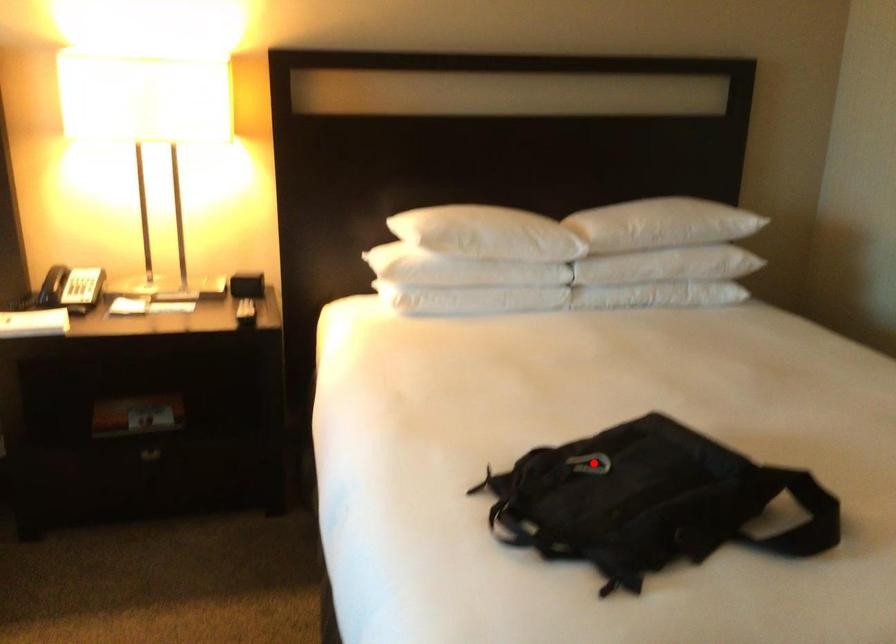
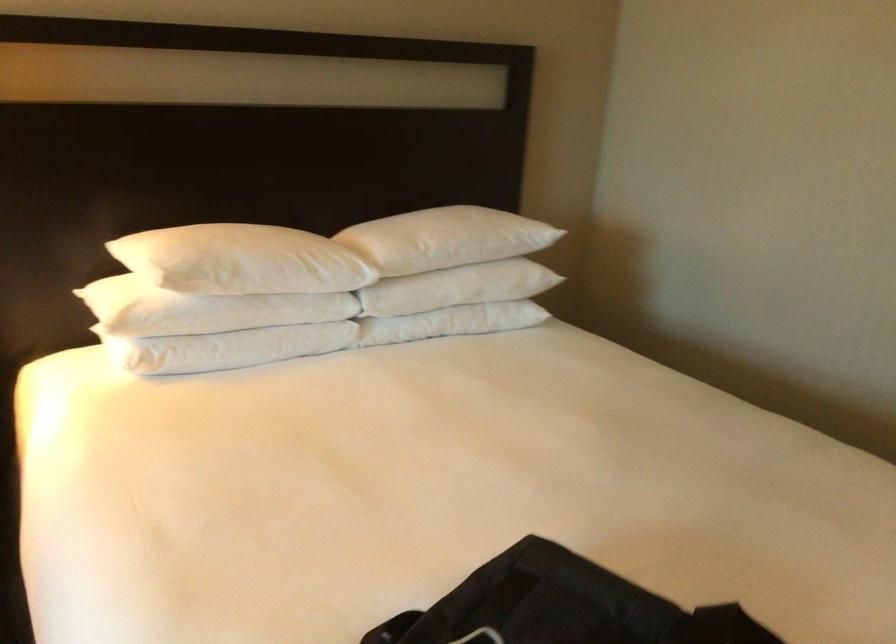
In the second image, find the point that corresponds to the highlighted location in the first image.

(480, 637)